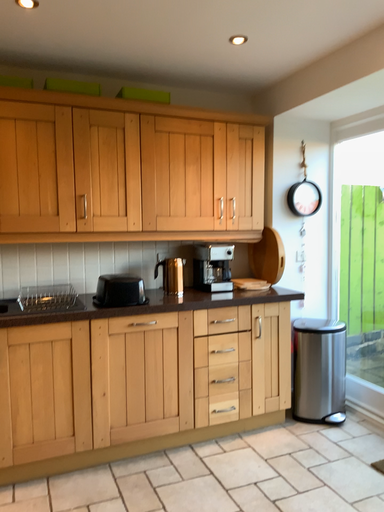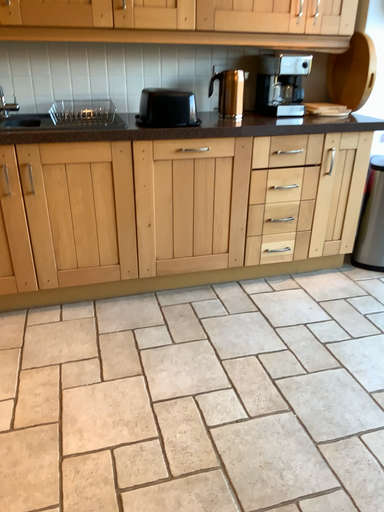
Question: Which way did the camera rotate in the video?

Choices:
 (A) rotated right
 (B) rotated left

Answer: (B)